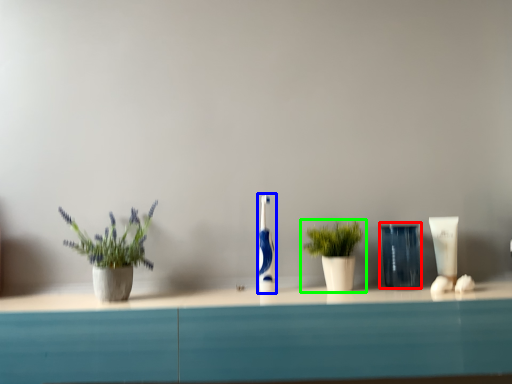
Question: Estimate the real-world distances between objects in this image. Which object is farther from glass vase (highlighted by a red box), toothbrush (highlighted by a blue box) or houseplant (highlighted by a green box)?

Choices:
 (A) toothbrush
 (B) houseplant

Answer: (A)